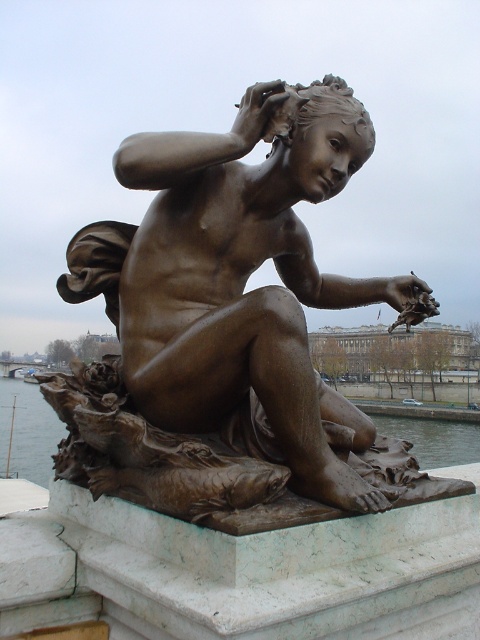
The image size is (480, 640). I want to click on bronze statue at center, so click(231, 326).

Is bronze statue at center shorter than clear water at statue center?

Indeed, bronze statue at center has a lesser height compared to clear water at statue center.

I want to click on bronze statue at center, so click(x=231, y=326).